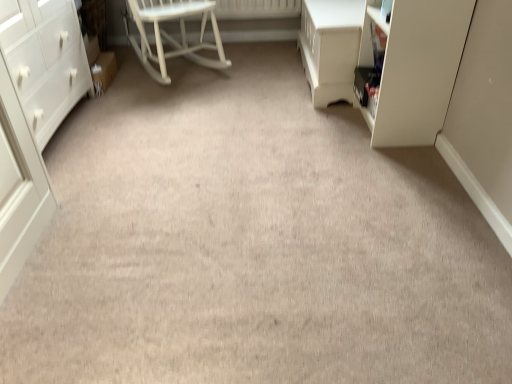
Where is `free space between matte white cabinet at right and white glossy vanity at upper right`? free space between matte white cabinet at right and white glossy vanity at upper right is located at coordinates (339, 115).